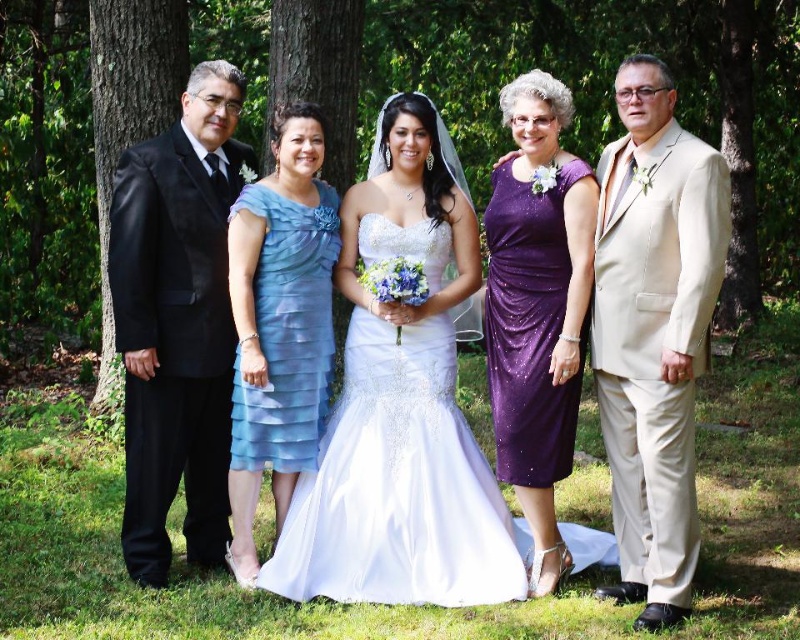
From the picture: You are a photographer standing at the center of the scene. You need to adjust your camera to focus on the white satin dress at center. What are the coordinates you should set in your camera to ensure the dress is in the center of the frame?

The coordinates to focus on the white satin dress at center should be set to point (x=397, y=484) to ensure it is centered in the frame.

You are a photographer at a wedding event. You have a camera with a lens that can focus on objects within a 20 inch range. You see the white satin dress at center and the sparkly purple dress at center. Can your camera focus on both dresses at the same time?

The distance between the white satin dress at center and the sparkly purple dress at center is 25.34 inches. Since the camera lens can only focus within a 20 inch range, it cannot capture both dresses in focus simultaneously.

You are a photographer adjusting your camera settings to focus on the white satin dress at center. Given that the camera can only focus on objects within a 0.5 unit radius from the center point at coordinates 0.5, 0.5, will the dress be in focus?

The white satin dress at center is located at point [397,484]. The distance from the camera center point [400,320] is calculated as sqrt of squared differences in x and y coordinates. The distance is sqrt of 0.259 squared plus 0.00009 squared, which is approximately 0.259 units. Since this is within the 0.5 unit radius, the dress will be in focus.